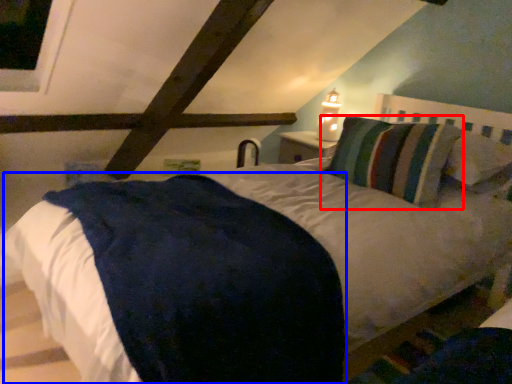
Question: Which point is further to the camera, pillow (highlighted by a red box) or mattress (highlighted by a blue box)?

Choices:
 (A) pillow
 (B) mattress

Answer: (A)